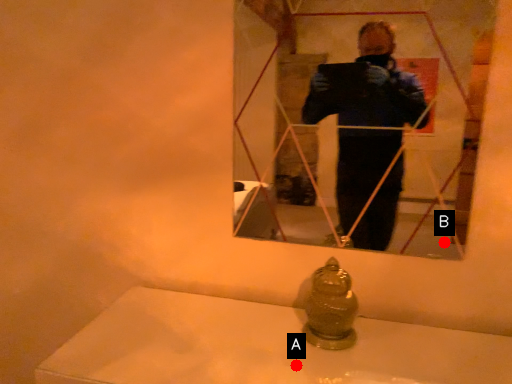
Question: Two points are circled on the image, labeled by A and B beside each circle. Which point is closer to the camera?

Choices:
 (A) A is closer
 (B) B is closer

Answer: (A)